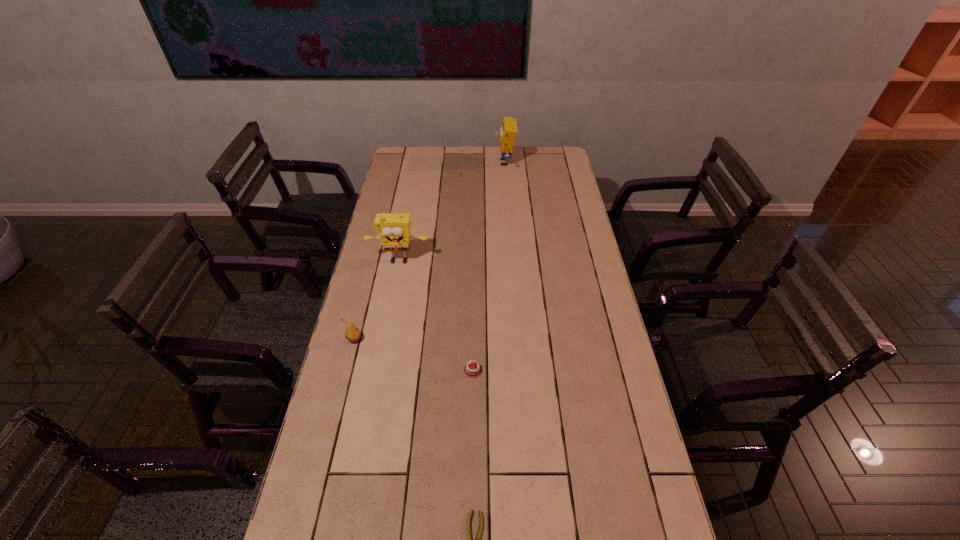
You are a GUI agent. You are given a task and a screenshot of the screen. Output one action in this format:
    pyautogui.click(x=<x>, y=<y>)
    Task: Click on the vacant area located on the face of the rightmost object
    This screenshot has width=960, height=540.
    Given the screenshot: What is the action you would take?
    (416, 163)

Where is `free region located on the front-facing side of the left sponge`? free region located on the front-facing side of the left sponge is located at coordinates (394, 291).

Locate an element on the screen. This screenshot has height=540, width=960. free space located 0.300m on the back of the pear is located at coordinates (372, 271).

The image size is (960, 540). Find the location of `vacant space located on the back of the fourth tallest object`. vacant space located on the back of the fourth tallest object is located at coordinates (473, 330).

The image size is (960, 540). I want to click on object that is at the far edge, so [508, 131].

Find the location of a particular element. The height and width of the screenshot is (540, 960). sponge present at the left edge is located at coordinates (394, 229).

At what (x,y) coordinates should I click in order to perform the action: click on pear situated at the left edge. Please return your answer as a coordinate pair (x, y). Looking at the image, I should click on (352, 334).

You are a GUI agent. You are given a task and a screenshot of the screen. Output one action in this format:
    pyautogui.click(x=<x>, y=<y>)
    Task: Click on the free space at the far edge of the desktop
    
    Given the screenshot: What is the action you would take?
    pyautogui.click(x=514, y=159)

You are a GUI agent. You are given a task and a screenshot of the screen. Output one action in this format:
    pyautogui.click(x=<x>, y=<y>)
    Task: Click on the free spot at the left edge of the desktop
    
    Given the screenshot: What is the action you would take?
    pyautogui.click(x=377, y=343)

This screenshot has width=960, height=540. Identify the location of vacant space at the right edge of the desktop. (561, 259).